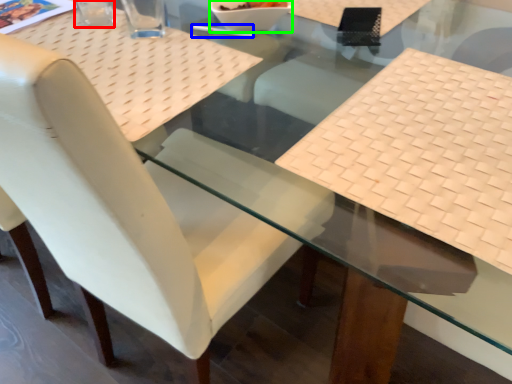
Question: Based on their relative distances, which object is farther from clear (highlighted by a red box)? Choose from chopstick (highlighted by a blue box) and glass bowl (highlighted by a green box).

Choices:
 (A) chopstick
 (B) glass bowl

Answer: (B)